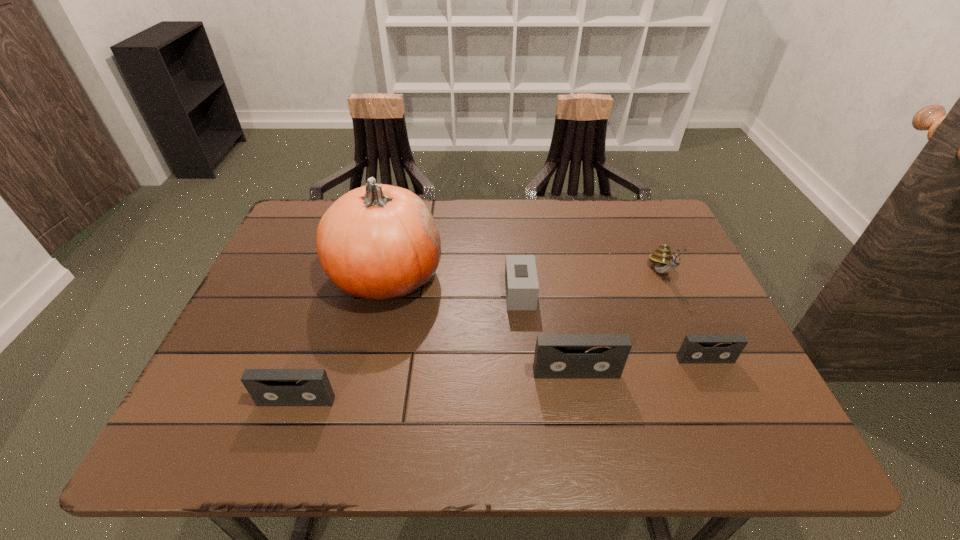
Where is `object that is at the near left corner`? The width and height of the screenshot is (960, 540). object that is at the near left corner is located at coordinates (267, 387).

You are a GUI agent. You are given a task and a screenshot of the screen. Output one action in this format:
    pyautogui.click(x=<x>, y=<y>)
    Task: Click on the free location at the far edge
    The image size is (960, 540).
    Given the screenshot: What is the action you would take?
    pyautogui.click(x=444, y=209)

Locate an element on the screen. This screenshot has height=540, width=960. vacant space at the near edge of the desktop is located at coordinates (350, 399).

You are a GUI agent. You are given a task and a screenshot of the screen. Output one action in this format:
    pyautogui.click(x=<x>, y=<y>)
    Task: Click on the vacant region at the left edge
    The image size is (960, 540).
    Given the screenshot: What is the action you would take?
    pyautogui.click(x=278, y=293)

You are a GUI agent. You are given a task and a screenshot of the screen. Output one action in this format:
    pyautogui.click(x=<x>, y=<y>)
    Task: Click on the vacant region at the right edge of the desktop
    This screenshot has width=960, height=540.
    Given the screenshot: What is the action you would take?
    [x=656, y=283]

You are a GUI agent. You are given a task and a screenshot of the screen. Output one action in this format:
    pyautogui.click(x=<x>, y=<y>)
    Task: Click on the vacant space at the far left corner of the desktop
    The image size is (960, 540).
    Given the screenshot: What is the action you would take?
    point(292,222)

Identify the location of vacant point at the far right corner. (647, 228).

Identify the location of vacant area that lies between the tallest videotape and the leftmost videotape. (436, 387).

The width and height of the screenshot is (960, 540). Identify the location of vacant point located between the pumpkin and the tallest videotape. (481, 324).

Locate an element on the screen. The image size is (960, 540). free point between the second videotape from left to right and the snail is located at coordinates (619, 322).